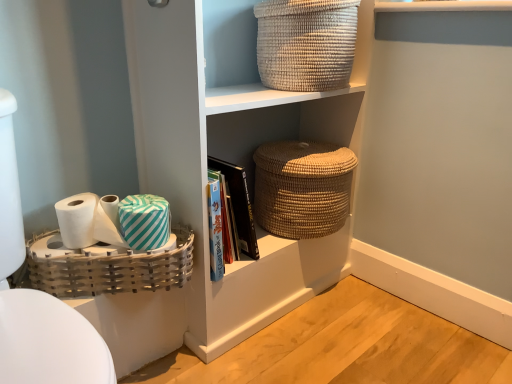
Question: Is natural woven basket at upper center, the 3th basket in the bottom-to-top sequence, inside the boundaries of white matte toilet paper at lower left, the second toilet paper viewed from the left, or outside?

Choices:
 (A) inside
 (B) outside

Answer: (B)

Question: Considering the positions of natural woven basket at upper center, the 1th basket positioned from the top, and white matte toilet paper at lower left, the first toilet paper from the right, in the image, is natural woven basket at upper center, the 1th basket positioned from the top, taller or shorter than white matte toilet paper at lower left, the first toilet paper from the right,?

Choices:
 (A) tall
 (B) short

Answer: (A)

Question: Which of these objects is positioned closest to the natural woven basket at upper center, the 1th basket positioned from the top?

Choices:
 (A) teal striped fabric at lower left
 (B) white glossy toilet bowl at left
 (C) hardcover book at center
 (D) white matte toilet paper at lower left, the 1th toilet paper positioned from the left
 (E) white matte toilet paper at lower left, the second toilet paper viewed from the left

Answer: (C)

Question: Based on their relative distances, which object is farther from the white glossy toilet bowl at left?

Choices:
 (A) white matte toilet paper at lower left, placed as the 2th toilet paper when sorted from right to left
 (B) teal striped fabric at lower left
 (C) natural woven basket at upper center, the 1th basket positioned from the top
 (D) hardcover book at center
 (E) natural woven basket at center

Answer: (C)